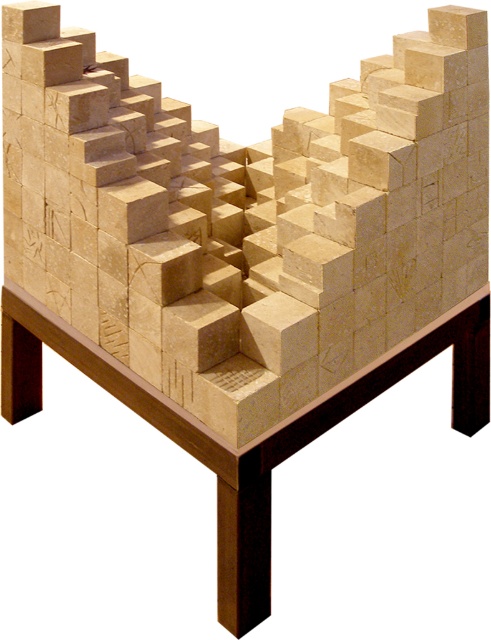
Question: Which point is farther to the camera?

Choices:
 (A) (117, 381)
 (B) (125, 348)

Answer: (A)

Question: Which object appears farthest from the camera in this image?

Choices:
 (A) natural wood cube at center
 (B) wooden table at center

Answer: (B)

Question: Does natural wood cube at center appear under wooden table at center?

Choices:
 (A) yes
 (B) no

Answer: (B)

Question: Does natural wood cube at center appear over wooden table at center?

Choices:
 (A) no
 (B) yes

Answer: (B)

Question: Is natural wood cube at center wider than wooden table at center?

Choices:
 (A) yes
 (B) no

Answer: (B)

Question: Among these points, which one is farthest from the camera?

Choices:
 (A) (463, 330)
 (B) (53, 17)

Answer: (A)